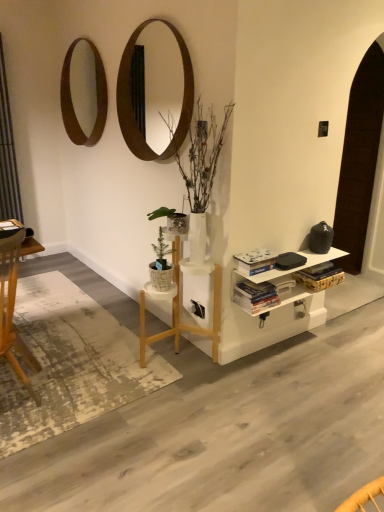
Question: From the image's perspective, is white wood table at center positioned above or below hardcover books at center, placed as the first book when sorted from bottom to top?

Choices:
 (A) below
 (B) above

Answer: (A)

Question: Based on their sizes in the image, would you say white wood table at center is bigger or smaller than hardcover books at center, the second book positioned from the top?

Choices:
 (A) small
 (B) big

Answer: (B)

Question: Which of these objects is positioned farthest from the wooden mirror at upper center, which is the first mirror in front-to-back order?

Choices:
 (A) hardcover books at center, placed as the first book when sorted from bottom to top
 (B) metallic gray curtain at left
 (C) white painted wood shelf at lower right
 (D) wooden circular mirror at upper left, which is the 1th mirror from left to right
 (E) green leafy plant at center

Answer: (A)

Question: Based on their relative distances, which object is farther from the white wood table at center?

Choices:
 (A) green leafy plant at center
 (B) wooden mirror at upper center, which is the first mirror in front-to-back order
 (C) metallic gray curtain at left
 (D) wooden circular mirror at upper left, the 2th mirror positioned from the front
 (E) hardcover books at center, placed as the first book when sorted from bottom to top

Answer: (C)